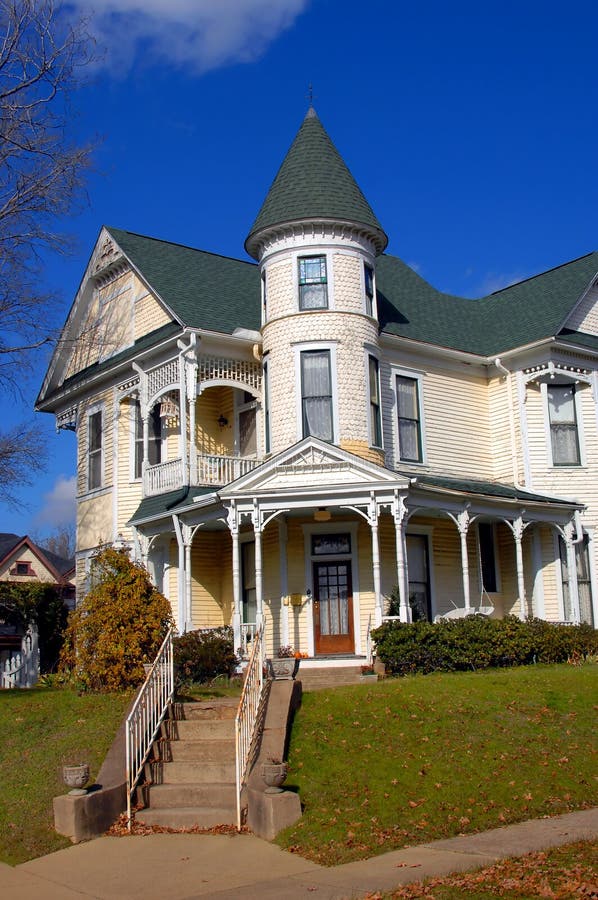
Where is `stairs`? This screenshot has height=900, width=598. stairs is located at coordinates (204, 747).